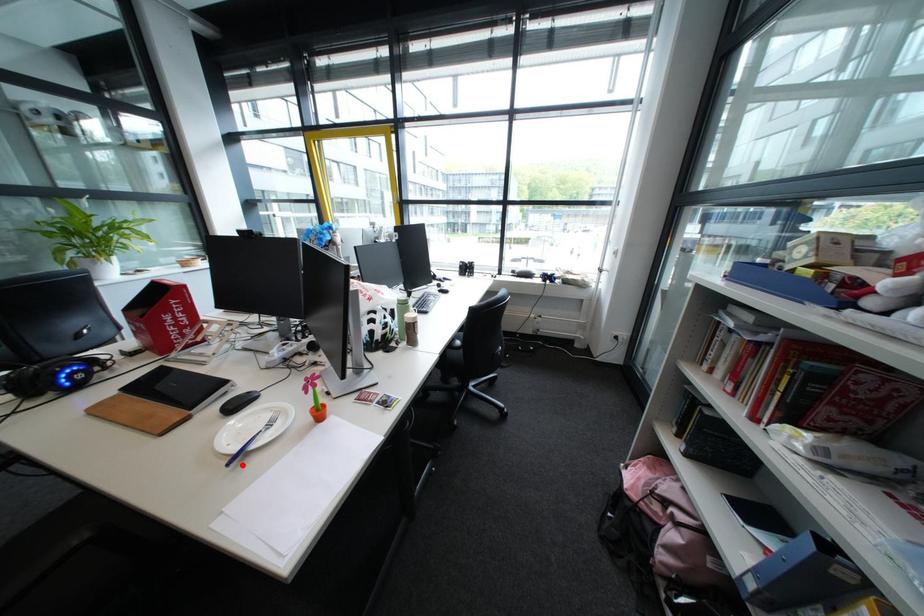
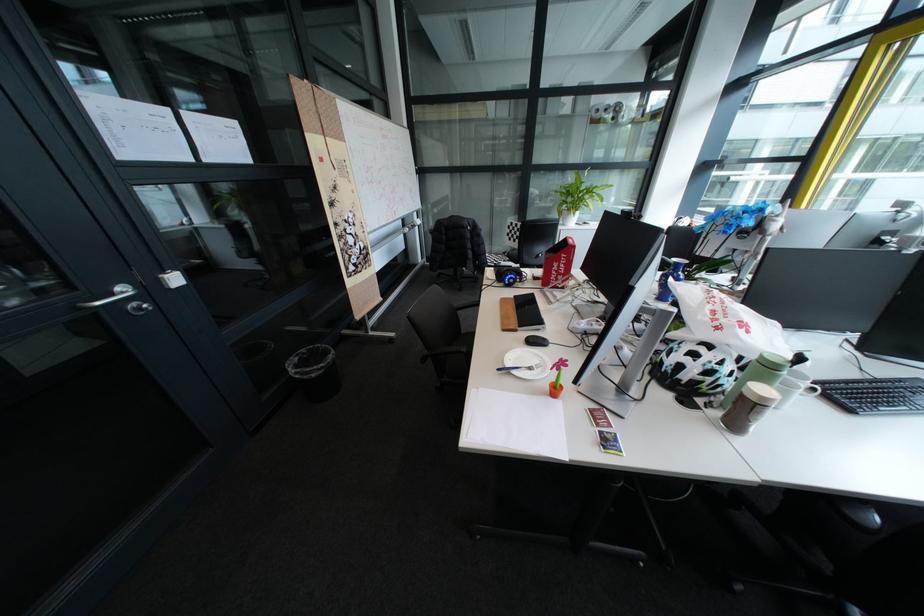
In the second image, find the point that corresponds to the highlighted location in the first image.

(513, 370)